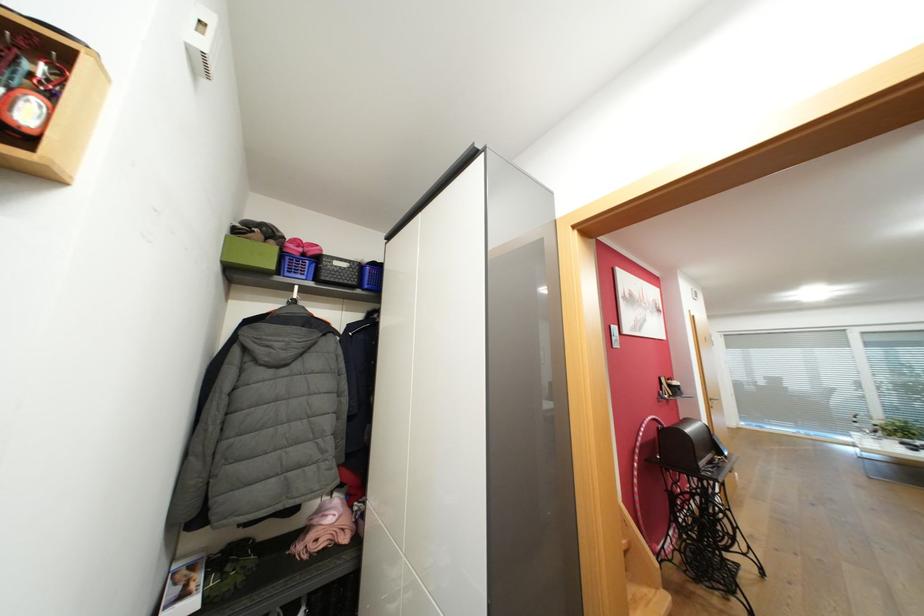
What are the coordinates of `sewing machine cover` in the screenshot? It's located at (685, 444).